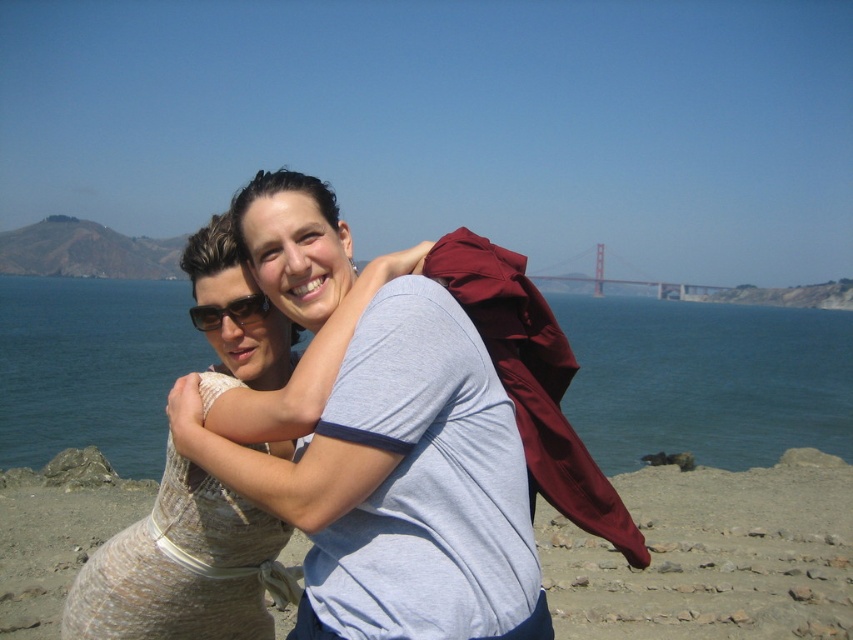
Question: Does blue water at center have a larger size compared to smooth sand at center?

Choices:
 (A) yes
 (B) no

Answer: (A)

Question: Can you confirm if smooth sand at center is bigger than metallic bridge at center?

Choices:
 (A) yes
 (B) no

Answer: (B)

Question: Which of the following is the farthest from the observer?

Choices:
 (A) blue water at center
 (B) light beige textured dress at center
 (C) beige textured dress at center

Answer: (A)

Question: Does blue water at center appear over beige textured dress at center?

Choices:
 (A) yes
 (B) no

Answer: (A)

Question: Based on their relative distances, which object is nearer to the smooth sand at center?

Choices:
 (A) light beige textured dress at center
 (B) blue water at center

Answer: (A)

Question: Which point is farther from the camera taking this photo?

Choices:
 (A) (701, 298)
 (B) (132, 321)
 (C) (332, 502)

Answer: (A)